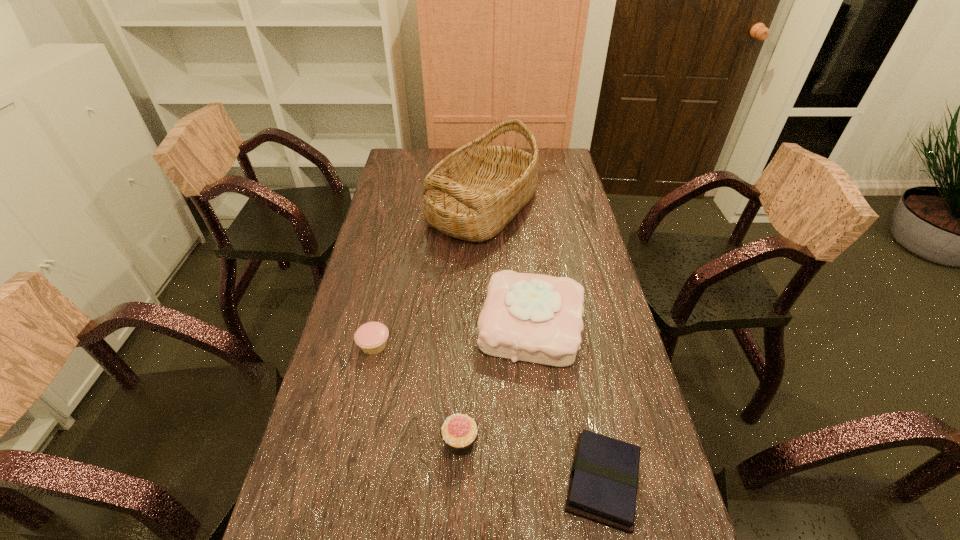
Locate an element on the screen. unoccupied position between the cake and the nearer cupcake is located at coordinates (495, 384).

Where is `object identified as the third closest to the third shortest object`? This screenshot has width=960, height=540. object identified as the third closest to the third shortest object is located at coordinates (371, 337).

Choose which object is the second nearest neighbor to the left cupcake. Please provide its 2D coordinates. Your answer should be formatted as a tuple, i.e. [(x, y)], where the tuple contains the x and y coordinates of a point satisfying the conditions above.

[(459, 431)]